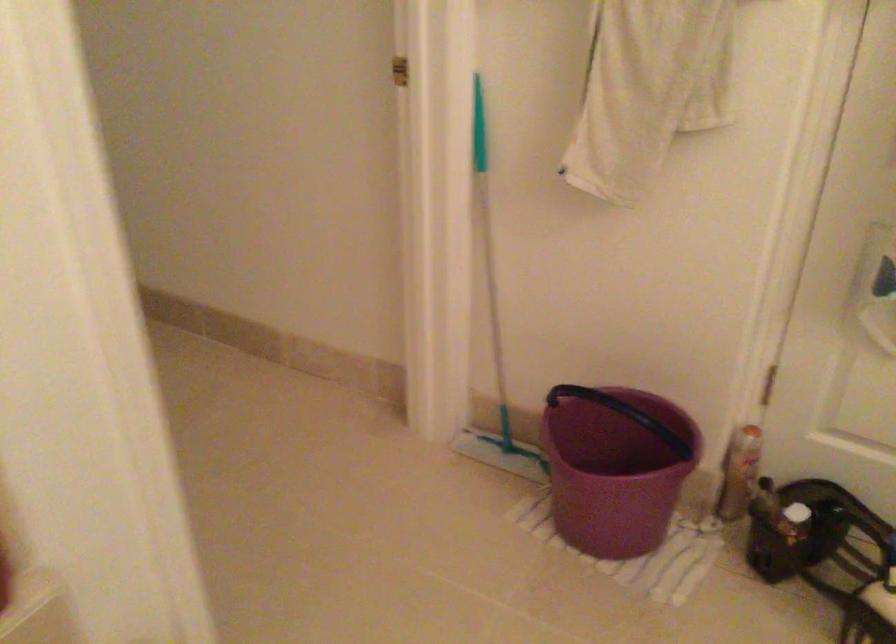
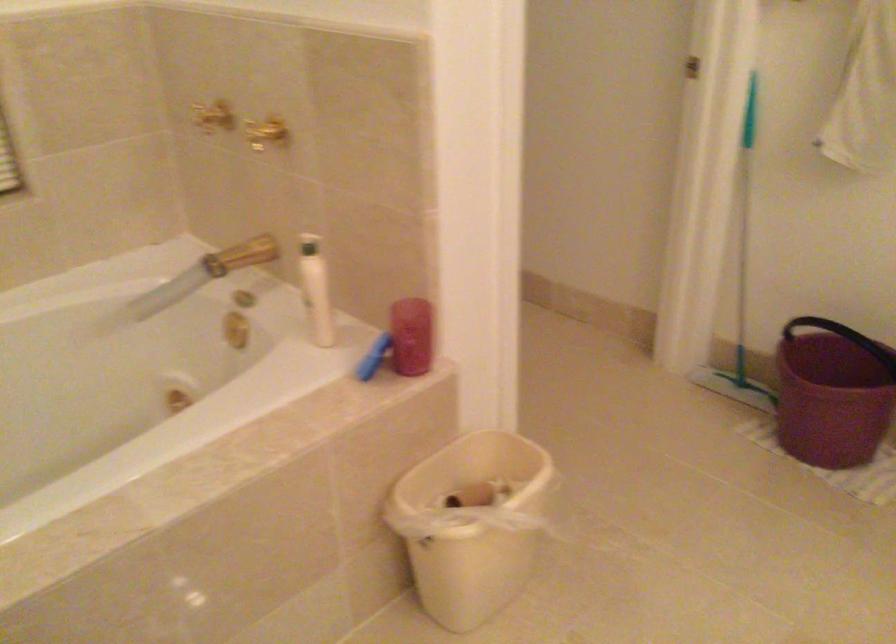
Locate, in the second image, the point that corresponds to point (608, 487) in the first image.

(831, 393)